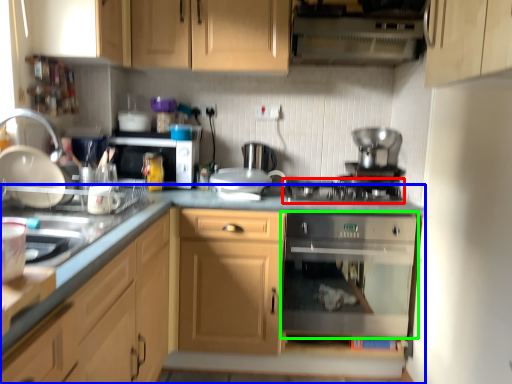
Question: Which object is positioned closest to gas stove (highlighted by a red box)? Select from cabinetry (highlighted by a blue box) and home appliance (highlighted by a green box).

Choices:
 (A) cabinetry
 (B) home appliance

Answer: (A)